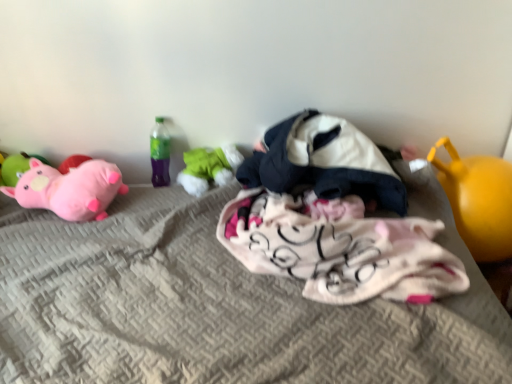
Question: Is matte pink plush at left, acting as the 4th toy starting from the right, in front of or behind white soft blanket at center, placed as the 2th toy when sorted from right to left, in the image?

Choices:
 (A) front
 (B) behind

Answer: (B)

Question: Which is correct: matte pink plush at left, acting as the 4th toy starting from the right, is inside white soft blanket at center, which is counted as the fourth toy, starting from the left, or outside of it?

Choices:
 (A) outside
 (B) inside

Answer: (A)

Question: Which object is the farthest from the pink plush pig at left, the 5th toy in the right-to-left sequence?

Choices:
 (A) textured gray mattress at center
 (B) matte pink plush at left, acting as the 2th toy starting from the left
 (C) green fabric toy at center, the 3th toy in the right-to-left sequence
 (D) yellow rubber ball at right, which is counted as the 1th toy, starting from the right
 (E) fluffy pink blanket at center

Answer: (D)

Question: Which of these objects is positioned farthest from the matte pink plush at left, acting as the 4th toy starting from the right?

Choices:
 (A) white soft blanket at center, which is counted as the fourth toy, starting from the left
 (B) green fabric toy at center, the third toy when ordered from left to right
 (C) fluffy pink blanket at center
 (D) pink plush pig at left, the 5th toy in the right-to-left sequence
 (E) yellow rubber ball at right, which is counted as the 1th toy, starting from the right

Answer: (E)